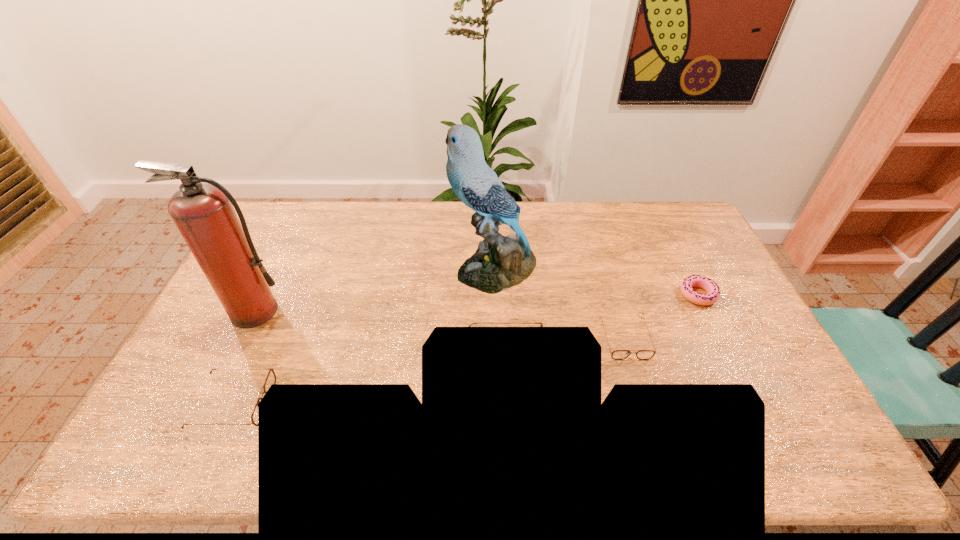
Where is `object that is at the near left corner`? The width and height of the screenshot is (960, 540). object that is at the near left corner is located at coordinates (271, 377).

Identify the location of free spot at the far edge of the desktop. This screenshot has width=960, height=540. (417, 240).

Identify the location of vacant space at the near edge of the desktop. (462, 390).

Identify the location of vacant space at the left edge of the desktop. This screenshot has width=960, height=540. (228, 367).

The height and width of the screenshot is (540, 960). What are the coordinates of `vacant area at the right edge` in the screenshot? It's located at (695, 272).

In the image, there is a desktop. Identify the location of vacant space at the far left corner. (277, 238).

You are a GUI agent. You are given a task and a screenshot of the screen. Output one action in this format:
    pyautogui.click(x=<x>, y=<y>)
    Task: Click on the vacant space that is in between the second shortest sunglasses and the third tallest object
    
    Given the screenshot: What is the action you would take?
    pyautogui.click(x=370, y=381)

At what (x,y) coordinates should I click in order to perform the action: click on free spot between the leftmost sunglasses and the doughnut. Please return your answer as a coordinate pair (x, y). Looking at the image, I should click on (466, 349).

You are a GUI agent. You are given a task and a screenshot of the screen. Output one action in this format:
    pyautogui.click(x=<x>, y=<y>)
    Task: Click on the empty space that is in between the second sunglasses from right to left and the second object from right to left
    This screenshot has width=960, height=540.
    Given the screenshot: What is the action you would take?
    pyautogui.click(x=565, y=349)

Image resolution: width=960 pixels, height=540 pixels. Identify the location of free space between the tallest sunglasses and the rightmost sunglasses. (565, 349).